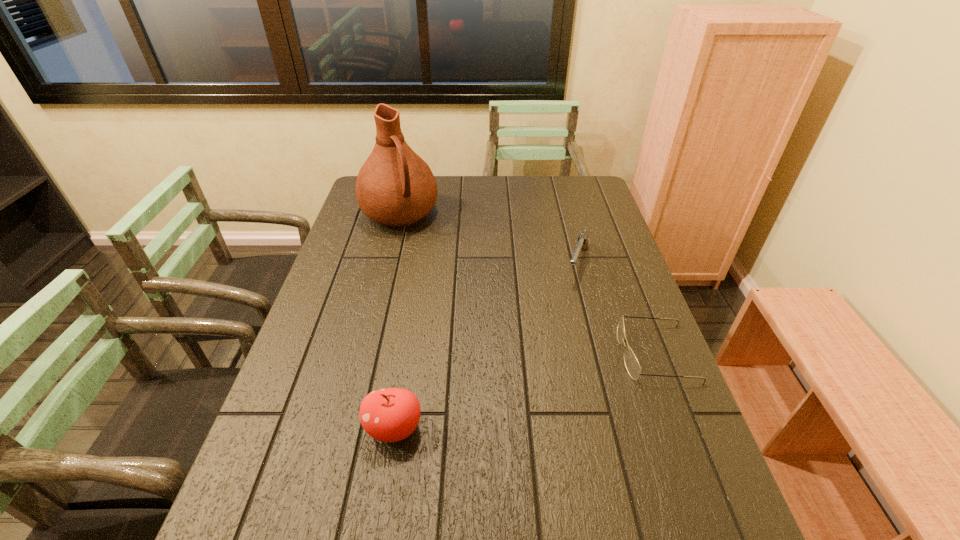
Locate an element on the screen. The height and width of the screenshot is (540, 960). the nearest object is located at coordinates (388, 415).

What are the coordinates of `the second tallest object` in the screenshot? It's located at (388, 415).

Locate an element on the screen. spectacles is located at coordinates (632, 365).

Find the location of a particular element. This screenshot has width=960, height=540. the second nearest object is located at coordinates (632, 365).

This screenshot has height=540, width=960. I want to click on the farthest object, so click(x=395, y=187).

Find the location of a particular element. the tallest object is located at coordinates (395, 187).

Where is `the third tallest object`? The width and height of the screenshot is (960, 540). the third tallest object is located at coordinates (582, 243).

Where is `gun`? Image resolution: width=960 pixels, height=540 pixels. gun is located at coordinates (582, 243).

The width and height of the screenshot is (960, 540). I want to click on free space located on the front of the second tallest object, so click(386, 481).

This screenshot has width=960, height=540. What are the coordinates of `vacant space situated 0.220m on the front-facing side of the spectacles` in the screenshot? It's located at (533, 354).